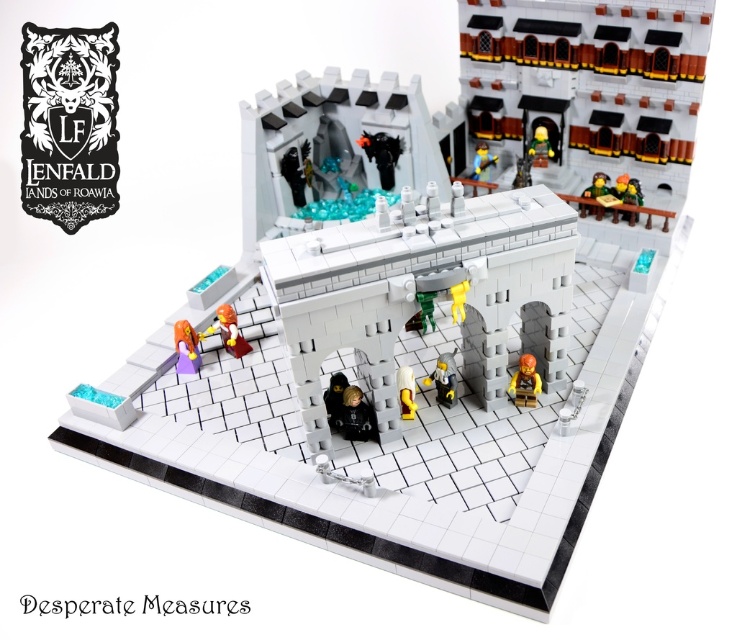
Is smooth yellow minifigure at center above matte green minifigure at upper right?

Actually, smooth yellow minifigure at center is below matte green minifigure at upper right.

Between point (450, 369) and point (590, 196), which one is positioned in front?

Point (450, 369) is in front.

You are a GUI agent. You are given a task and a screenshot of the screen. Output one action in this format:
    pyautogui.click(x=<x>, y=<y>)
    Task: Click on the smooth yellow minifigure at center
    The height and width of the screenshot is (640, 737).
    Given the screenshot: What is the action you would take?
    pyautogui.click(x=444, y=378)

Does yellow plastic figure at center have a greater width compared to matte brown wooden table at upper right?

No, yellow plastic figure at center is not wider than matte brown wooden table at upper right.

Can you confirm if yellow plastic figure at center is shorter than matte brown wooden table at upper right?

Yes, yellow plastic figure at center is shorter than matte brown wooden table at upper right.

What do you see at coordinates (405, 392) in the screenshot?
I see `yellow plastic figure at center` at bounding box center [405, 392].

Locate an element on the screen. yellow plastic figure at center is located at coordinates (405, 392).

Between yellow plastic figure at center and matte green minifigure at upper right, which one appears on the right side from the viewer's perspective?

From the viewer's perspective, matte green minifigure at upper right appears more on the right side.

Does yellow plastic figure at center have a greater height compared to matte green minifigure at upper right?

No.

Is point (408, 394) in front of point (598, 179)?

Yes.

Where is `yellow plastic figure at center`? This screenshot has width=737, height=640. yellow plastic figure at center is located at coordinates (405, 392).